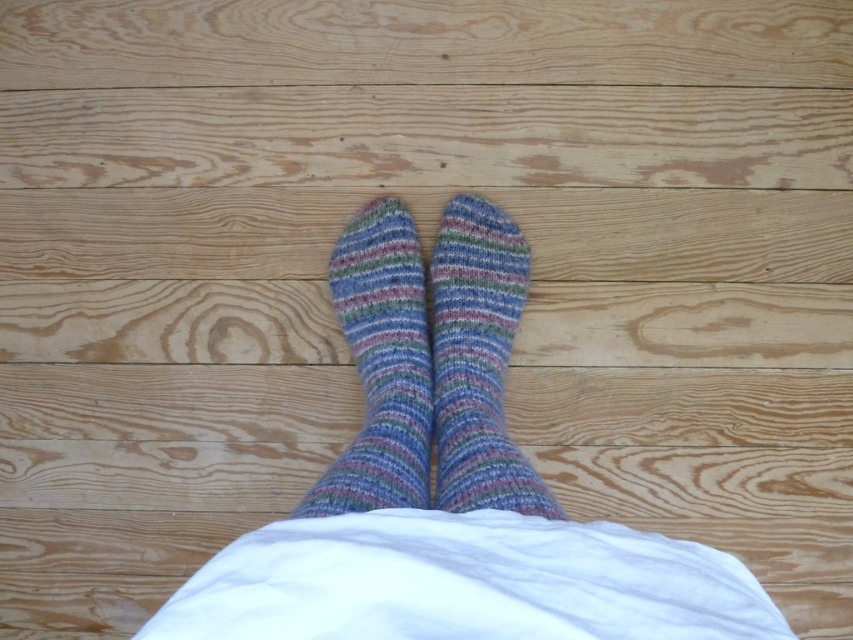
Question: Which point is farther from the camera taking this photo?

Choices:
 (A) (386, 262)
 (B) (497, 280)

Answer: (B)

Question: Which point is closer to the camera taking this photo?

Choices:
 (A) (508, 308)
 (B) (357, 504)

Answer: (B)

Question: Is multicolored knitted sock at center positioned in front of multicolored knitted socks at center?

Choices:
 (A) yes
 (B) no

Answer: (B)

Question: Can you confirm if multicolored knitted sock at center is wider than multicolored knitted socks at center?

Choices:
 (A) no
 (B) yes

Answer: (A)

Question: Does multicolored knitted sock at center lie behind multicolored knitted socks at center?

Choices:
 (A) yes
 (B) no

Answer: (A)